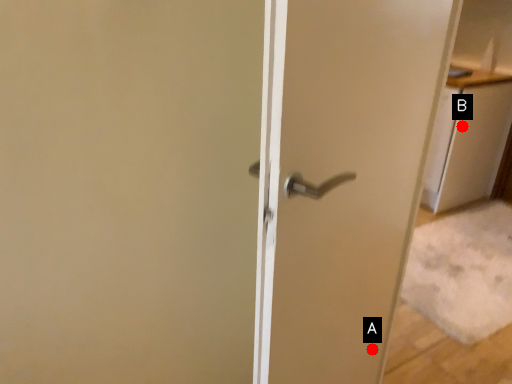
Question: Two points are circled on the image, labeled by A and B beside each circle. Which point is closer to the camera?

Choices:
 (A) A is closer
 (B) B is closer

Answer: (A)